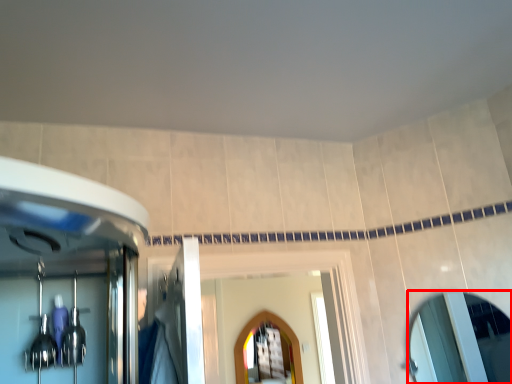
Question: From the image's perspective, where is mirror (annotated by the red box) located relative to mirror?

Choices:
 (A) above
 (B) below

Answer: (A)